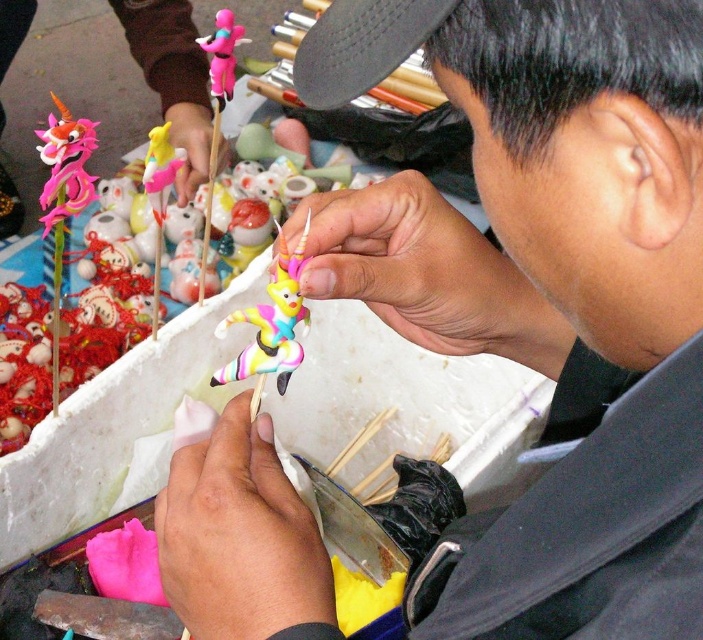
Does matte plastic unicorn at upper left appear on the right side of black matte baseball cap at upper center?

Incorrect, matte plastic unicorn at upper left is not on the right side of black matte baseball cap at upper center.

Is matte plastic unicorn at upper left below black matte baseball cap at upper center?

Incorrect, matte plastic unicorn at upper left is not positioned below black matte baseball cap at upper center.

Who is more distant from viewer, (x=32, y=10) or (x=341, y=35)?

The point (x=32, y=10) is more distant.

Identify the location of matte plastic unicorn at upper left. (172, 77).

Is matte plastic unicorn at upper left to the right of pink matte figurine at upper left from the viewer's perspective?

No, matte plastic unicorn at upper left is not to the right of pink matte figurine at upper left.

Is matte plastic unicorn at upper left further to camera compared to pink matte figurine at upper left?

Yes, matte plastic unicorn at upper left is further from the viewer.

Between point (127, 26) and point (232, 13), which one is positioned behind?

The point (232, 13) is behind.

Image resolution: width=703 pixels, height=640 pixels. What are the coordinates of `matte plastic unicorn at upper left` in the screenshot? It's located at (172, 77).

Who is more distant from viewer, (404,45) or (231,371)?

The point (231,371) is more distant.

Between black matte baseball cap at upper center and pastel plastic toy at center, which one appears on the right side from the viewer's perspective?

black matte baseball cap at upper center

Is point (361, 51) closer to camera compared to point (280, 369)?

Yes.

The image size is (703, 640). Identify the location of black matte baseball cap at upper center. (361, 45).